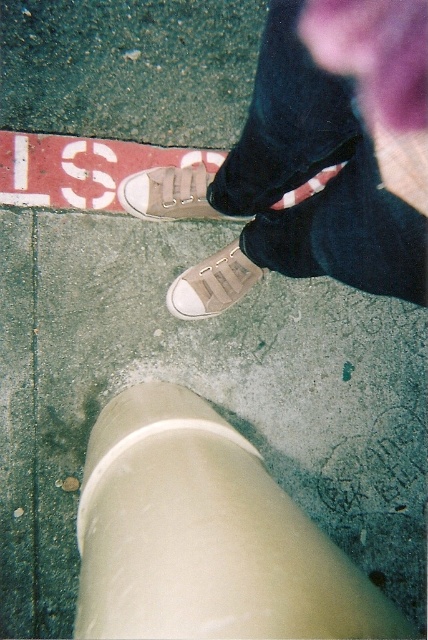
Question: Estimate the real-world distances between objects in this image. Which object is farther from the white smooth concrete at lower center?

Choices:
 (A) red plastic sign at upper left
 (B) matte beige sneakers at center
 (C) matte beige canvas shoe at center
 (D) white canvas shoe at center

Answer: (A)

Question: Is red plastic sign at upper left above matte beige canvas shoe at center?

Choices:
 (A) yes
 (B) no

Answer: (A)

Question: Where is matte beige sneakers at center located in relation to white canvas shoe at center in the image?

Choices:
 (A) left
 (B) right

Answer: (B)

Question: Observing the image, what is the correct spatial positioning of matte beige sneakers at center in reference to matte beige canvas shoe at center?

Choices:
 (A) above
 (B) below

Answer: (B)

Question: Among these points, which one is nearest to the camera?

Choices:
 (A) (270, 166)
 (B) (187, 193)
 (C) (327, 604)
 (D) (261, 273)

Answer: (C)

Question: Estimate the real-world distances between objects in this image. Which object is closer to the white smooth concrete at lower center?

Choices:
 (A) matte beige canvas shoe at center
 (B) red plastic sign at upper left
 (C) white canvas shoe at center
 (D) matte beige sneakers at center

Answer: (D)